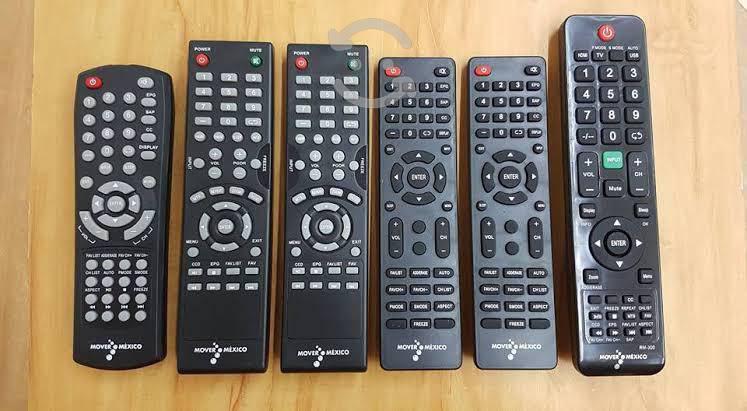
Identify the location of power buttons on remotes. click(90, 81), click(196, 58), click(297, 61), click(391, 71), click(483, 68), click(604, 32).